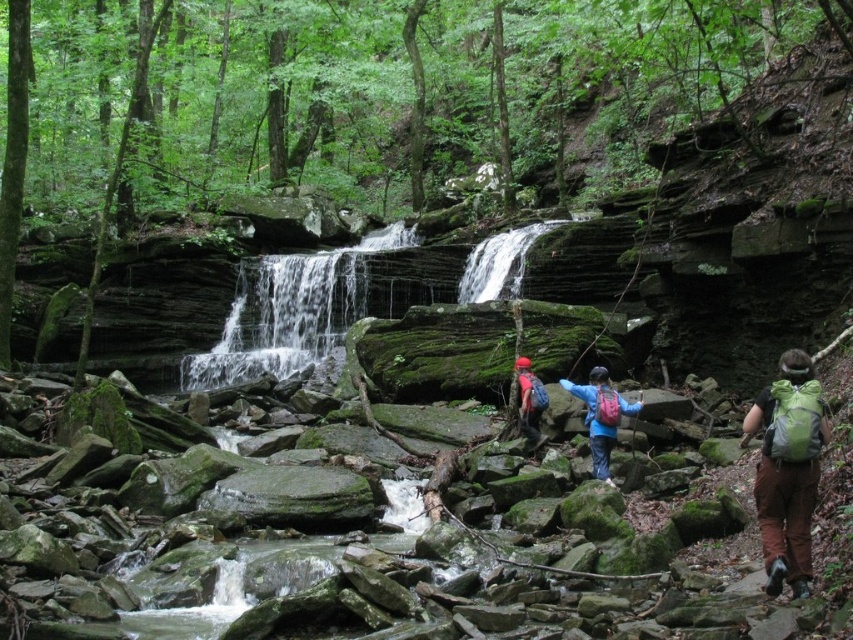
You are a hiker trying to find the best spot to take a photo of the waterfall. You notice the green mossy rock at center. Based on its position, can you determine if it would be a good foreground element for the waterfall in the background?

The green mossy rock at center is positioned centrally, making it an ideal foreground element to frame the waterfall in the background, enhancing the depth and visual appeal of the photo.

In the forest scene with the waterfall and hikers, there is a point marked at coordinates (291, 310). What does this point indicate?

The point at (291, 310) marks the location of the green mossy rock at center.

Looking at this image, you are a hiker trying to reach the white smooth waterfall at center. You see the green fabric backpack at right in your path. Is the backpack blocking your way to the waterfall?

The green fabric backpack at right is in front of the white smooth waterfall at center, so it is blocking your path to the waterfall.